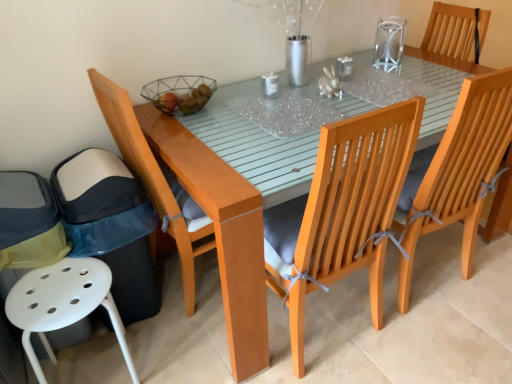
The height and width of the screenshot is (384, 512). I want to click on free space above white plastic stool at lower left, acting as the 1th chair starting from the left (from a real-world perspective), so click(60, 288).